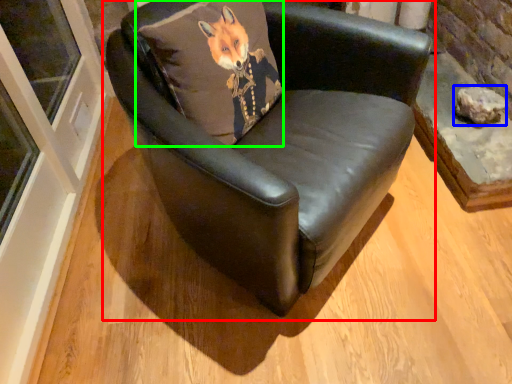
Question: Based on their relative distances, which object is nearer to chair (highlighted by a red box)? Choose from stone (highlighted by a blue box) and pillow (highlighted by a green box).

Choices:
 (A) stone
 (B) pillow

Answer: (B)